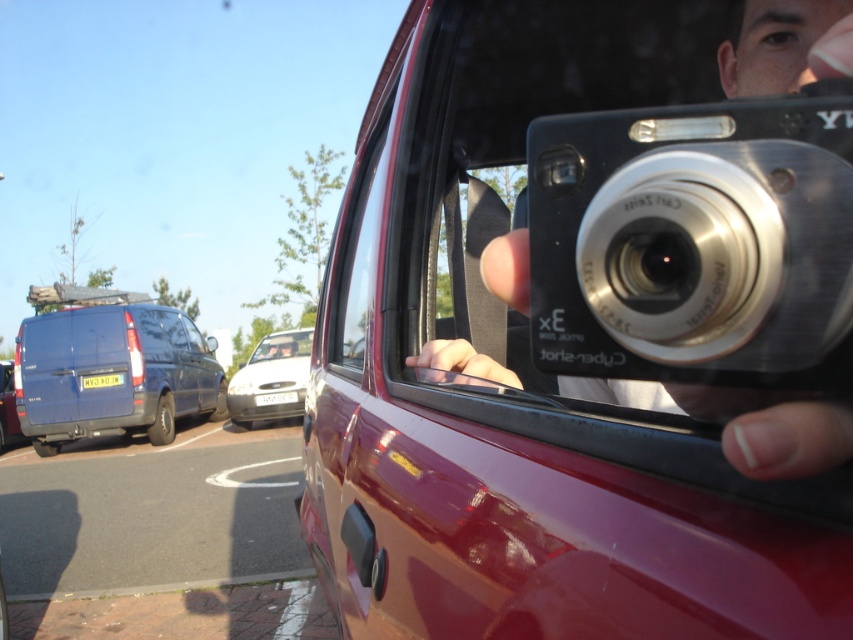
Is point (447, 176) positioned in front of point (0, 438)?

Yes, it is.

Who is positioned more to the left, shiny metallic car door at center or blue metallic van at left?

blue metallic van at left is more to the left.

I want to click on shiny metallic car door at center, so click(590, 326).

In order to click on shiny metallic car door at center in this screenshot , I will do `click(590, 326)`.

Does metallic blue van at left lie in front of blue metallic van at left?

Yes, metallic blue van at left is closer to the viewer.

Where is `metallic blue van at left`? The height and width of the screenshot is (640, 853). metallic blue van at left is located at coordinates (112, 372).

Locate an element on the screen. The image size is (853, 640). metallic blue van at left is located at coordinates (112, 372).

Who is taller, shiny metallic car door at center or metallic blue van at left?

With more height is metallic blue van at left.

Does shiny metallic car door at center appear on the right side of metallic blue van at left?

Correct, you'll find shiny metallic car door at center to the right of metallic blue van at left.

Between point (662, 164) and point (119, 346), which one is positioned in front?

Point (662, 164)

Identify the location of shiny metallic car door at center. The image size is (853, 640). (590, 326).